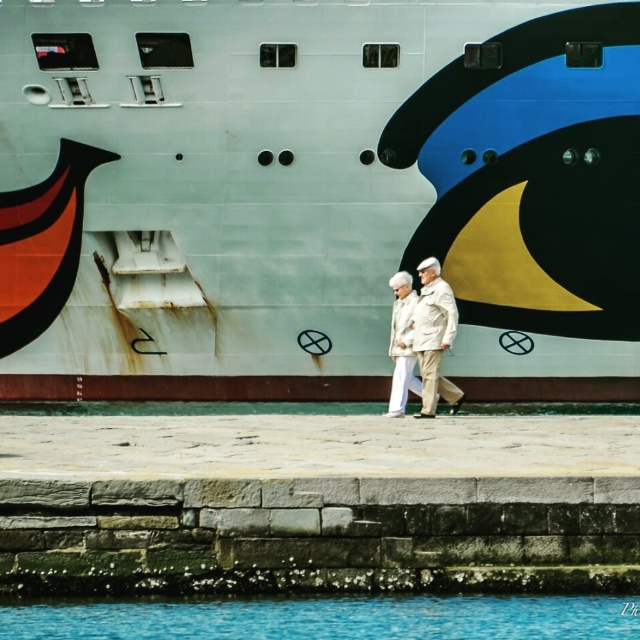
You are standing on the pier and looking at the white matte ship at center and the blue liquid water at lower center. Which object is closer to your eye level?

The white matte ship at center is closer to your eye level since it is positioned above the blue liquid water at lower center.

You are a photographer trying to capture a wide shot of the scene. You notice the white matte ship at center and the beige fabric coat at center. Which object should you focus on to ensure both are visible in the frame without needing to zoom in or out?

You should focus on the beige fabric coat at center because it is wider than the white matte ship at center, ensuring both fit within the frame without needing to adjust the zoom.

You are standing on the pier and want to take a photo of the cruise ship. To ensure the blue liquid water at lower center is in the frame, where should you position yourself relative to the pier?

You should position yourself at point (326, 618) on the pier to include the blue liquid water at lower center in your photo.